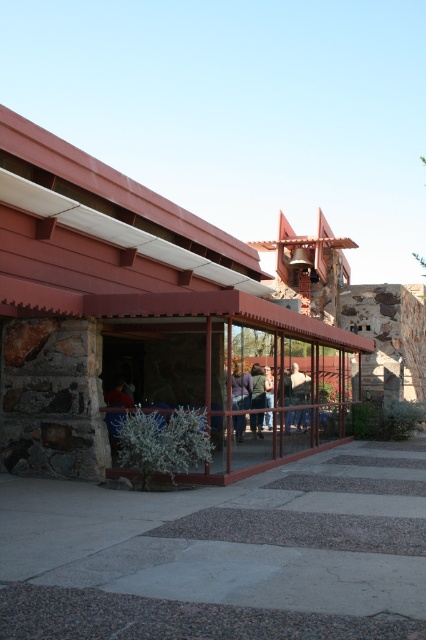
Question: Among these points, which one is nearest to the camera?

Choices:
 (A) (294, 376)
 (B) (278, 396)

Answer: (B)

Question: Which object is positioned farthest from the dark green fabric jacket at center?

Choices:
 (A) white fabric shirt at center
 (B) brown stone shed at center
 (C) matte gray sweater at center
 (D) light brown leather jacket at center

Answer: (B)

Question: Does brown stone shed at center appear under dark green fabric jacket at center?

Choices:
 (A) yes
 (B) no

Answer: (B)

Question: Considering the real-world distances, which object is closest to the light brown leather jacket at center?

Choices:
 (A) dark green fabric jacket at center
 (B) brown stone shed at center

Answer: (A)

Question: Can you confirm if brown stone shed at center is wider than dark green fabric jacket at center?

Choices:
 (A) no
 (B) yes

Answer: (B)

Question: Does brown stone shed at center come behind dark green fabric jacket at center?

Choices:
 (A) yes
 (B) no

Answer: (B)